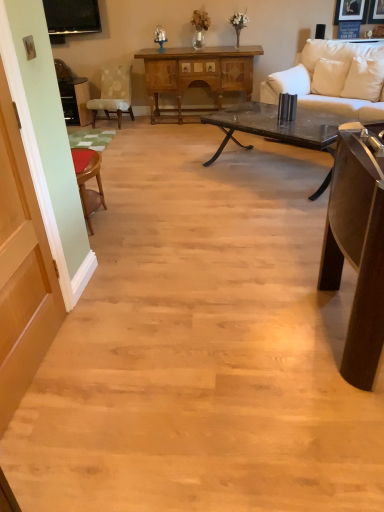
Identify the location of free point behind transparent glass door at left. (100, 310).